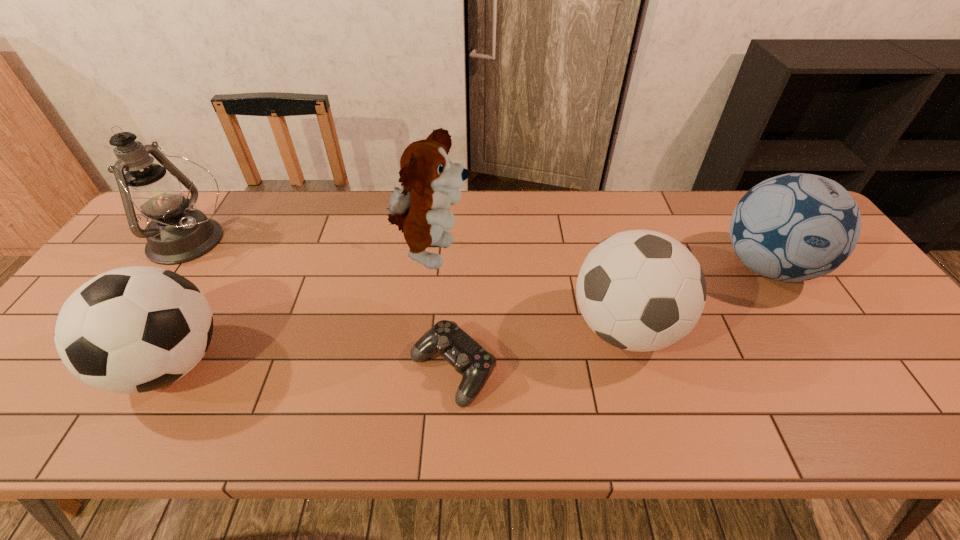
This screenshot has height=540, width=960. I want to click on oil lamp, so click(x=178, y=233).

Where is `puppy`? The height and width of the screenshot is (540, 960). puppy is located at coordinates (x=431, y=181).

Identify the location of the rightmost object. (794, 227).

Locate an element on the screen. The image size is (960, 540). the second soccer ball from right to left is located at coordinates (639, 290).

Image resolution: width=960 pixels, height=540 pixels. In order to click on the leftmost soccer ball in this screenshot , I will do `click(136, 329)`.

Where is `control`? control is located at coordinates (475, 364).

Where is `vacant region located 0.200m on the front of the oil lamp`? The image size is (960, 540). vacant region located 0.200m on the front of the oil lamp is located at coordinates (133, 325).

In order to click on vacant space located on the face of the puppy in this screenshot , I will do `click(537, 254)`.

Identify the location of vacant space located on the side with brand of the rightmost soccer ball. The height and width of the screenshot is (540, 960). (831, 369).

Find the location of a particular element. blank space located on the back of the second object from right to left is located at coordinates (596, 227).